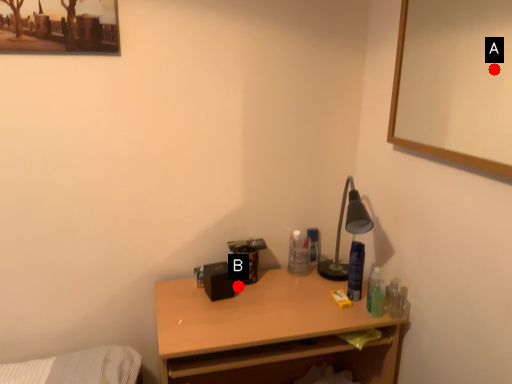
Question: Two points are circled on the image, labeled by A and B beside each circle. Which point appears closest to the camera in this image?

Choices:
 (A) A is closer
 (B) B is closer

Answer: (B)